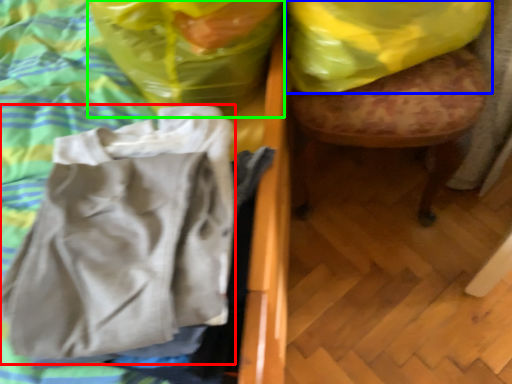
Question: Which object is the farthest from wrap (highlighted by a red box)? Choose among these: plastic bag (highlighted by a blue box) or plastic bag (highlighted by a green box).

Choices:
 (A) plastic bag
 (B) plastic bag

Answer: (A)